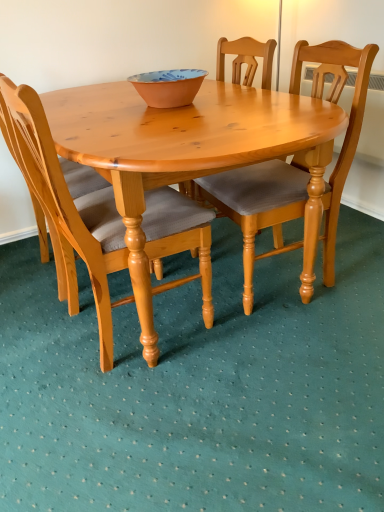
Question: Is terracotta ceramic bowl at center at the left side of light wood/texture chair at center, which is the 1th chair in left-to-right order?

Choices:
 (A) yes
 (B) no

Answer: (B)

Question: Does terracotta ceramic bowl at center have a smaller size compared to light wood/texture chair at center, which is the 2th chair from right to left?

Choices:
 (A) no
 (B) yes

Answer: (B)

Question: Is terracotta ceramic bowl at center outside of light wood/texture chair at center, which is the 1th chair in left-to-right order?

Choices:
 (A) yes
 (B) no

Answer: (A)

Question: Considering the relative sizes of terracotta ceramic bowl at center and light wood/texture chair at center, which is the 2th chair from right to left, in the image provided, is terracotta ceramic bowl at center bigger than light wood/texture chair at center, which is the 2th chair from right to left,?

Choices:
 (A) no
 (B) yes

Answer: (A)

Question: Is terracotta ceramic bowl at center positioned with its back to light wood/texture chair at center, which is the 2th chair from right to left?

Choices:
 (A) yes
 (B) no

Answer: (B)

Question: Considering the positions of light brown wood chair at center, positioned as the first chair in right-to-left order, and terracotta ceramic bowl at center in the image, is light brown wood chair at center, positioned as the first chair in right-to-left order, wider or thinner than terracotta ceramic bowl at center?

Choices:
 (A) wide
 (B) thin

Answer: (A)

Question: Considering their positions, is light brown wood chair at center, the second chair viewed from the left, located in front of or behind terracotta ceramic bowl at center?

Choices:
 (A) behind
 (B) front

Answer: (B)

Question: Considering the positions of light brown wood chair at center, the second chair viewed from the left, and terracotta ceramic bowl at center in the image, is light brown wood chair at center, the second chair viewed from the left, taller or shorter than terracotta ceramic bowl at center?

Choices:
 (A) tall
 (B) short

Answer: (A)

Question: From a real-world perspective, is light brown wood chair at center, the second chair viewed from the left, positioned above or below terracotta ceramic bowl at center?

Choices:
 (A) above
 (B) below

Answer: (B)

Question: In the image, is light wood/texture chair at center, which is the 2th chair from right to left, on the left side or the right side of light brown wood chair at center, positioned as the first chair in right-to-left order?

Choices:
 (A) left
 (B) right

Answer: (A)

Question: From their relative heights in the image, would you say light wood/texture chair at center, which is the 2th chair from right to left, is taller or shorter than light brown wood chair at center, the second chair viewed from the left?

Choices:
 (A) tall
 (B) short

Answer: (A)

Question: Based on their sizes in the image, would you say light wood/texture chair at center, which is the 2th chair from right to left, is bigger or smaller than light brown wood chair at center, positioned as the first chair in right-to-left order?

Choices:
 (A) big
 (B) small

Answer: (A)

Question: Looking at their shapes, would you say light wood/texture chair at center, which is the 1th chair in left-to-right order, is wider or thinner than light brown wood chair at center, positioned as the first chair in right-to-left order?

Choices:
 (A) thin
 (B) wide

Answer: (A)

Question: In terms of width, does terracotta ceramic bowl at center look wider or thinner when compared to light wood/texture chair at center, which is the 1th chair in left-to-right order?

Choices:
 (A) wide
 (B) thin

Answer: (B)

Question: From their relative heights in the image, would you say terracotta ceramic bowl at center is taller or shorter than light wood/texture chair at center, which is the 2th chair from right to left?

Choices:
 (A) tall
 (B) short

Answer: (B)